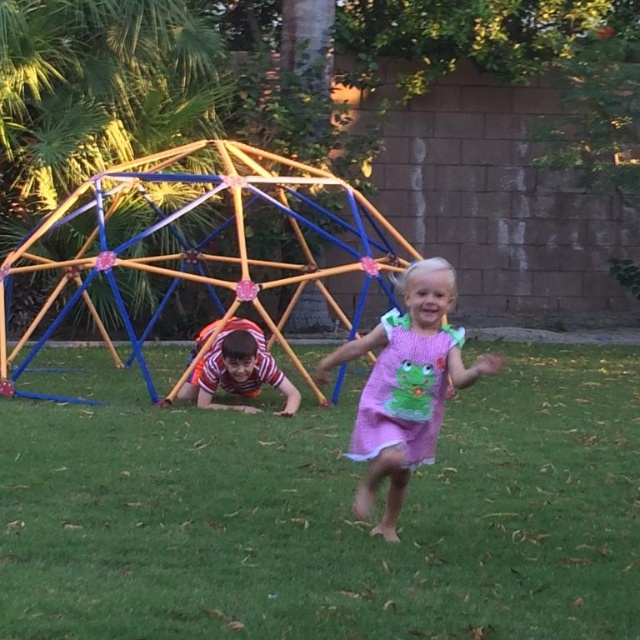
Question: Which point is closer to the camera taking this photo?

Choices:
 (A) 216,516
 (B) 227,362
 (C) 436,413
 (D) 8,300

Answer: (C)

Question: Considering the real-world distances, which object is closest to the metallic/plastic dome at upper center?

Choices:
 (A) pink fabric dress at center
 (B) orange striped shirt at lower left

Answer: (B)

Question: Does metallic/plastic dome at upper center appear on the left side of orange striped shirt at lower left?

Choices:
 (A) no
 (B) yes

Answer: (B)

Question: Observing the image, what is the correct spatial positioning of metallic/plastic dome at upper center in reference to orange striped shirt at lower left?

Choices:
 (A) below
 (B) above

Answer: (B)

Question: Can you confirm if pink fabric dress at center is thinner than orange striped shirt at lower left?

Choices:
 (A) yes
 (B) no

Answer: (A)

Question: Which object is farther from the camera taking this photo?

Choices:
 (A) orange striped shirt at lower left
 (B) pink fabric dress at center
 (C) green grass at center
 (D) metallic/plastic dome at upper center

Answer: (D)